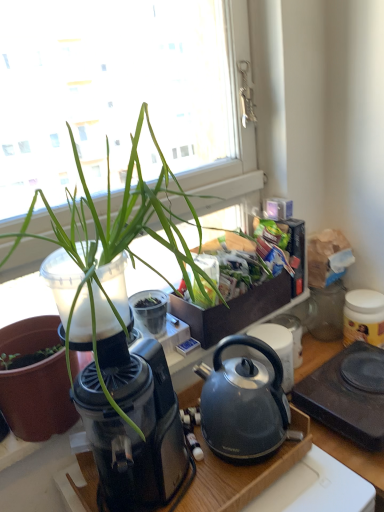
Question: Is matte black kettle at center, the 4th appliance when ordered from right to left, far from black plastic hot plate at lower right, arranged as the second appliance when viewed from the right?

Choices:
 (A) yes
 (B) no

Answer: (B)

Question: From the image's perspective, is matte black kettle at center, the first appliance viewed from the left, on black plastic hot plate at lower right, arranged as the second appliance when viewed from the right?

Choices:
 (A) no
 (B) yes

Answer: (B)

Question: Does matte black kettle at center, the 4th appliance when ordered from right to left, have a lesser height compared to black plastic hot plate at lower right, arranged as the second appliance when viewed from the right?

Choices:
 (A) no
 (B) yes

Answer: (A)

Question: Does matte black kettle at center, the first appliance viewed from the left, turn towards black plastic hot plate at lower right, arranged as the second appliance when viewed from the right?

Choices:
 (A) no
 (B) yes

Answer: (B)

Question: From a real-world perspective, is matte black kettle at center, the first appliance viewed from the left, positioned over black plastic hot plate at lower right, arranged as the second appliance when viewed from the right, based on gravity?

Choices:
 (A) no
 (B) yes

Answer: (B)

Question: From a real-world perspective, is matte black pot at left physically located above or below yellow matte jar at right, which is the 4th appliance from left to right?

Choices:
 (A) below
 (B) above

Answer: (B)

Question: Which is correct: matte black pot at left is inside yellow matte jar at right, which is counted as the first appliance, starting from the right, or outside of it?

Choices:
 (A) outside
 (B) inside

Answer: (A)

Question: Does point (49, 380) appear closer or farther from the camera than point (360, 294)?

Choices:
 (A) farther
 (B) closer

Answer: (B)

Question: Considering the positions of matte black pot at left and yellow matte jar at right, which is counted as the first appliance, starting from the right, in the image, is matte black pot at left wider or thinner than yellow matte jar at right, which is counted as the first appliance, starting from the right,?

Choices:
 (A) thin
 (B) wide

Answer: (B)

Question: From the image's perspective, is transparent plastic coffee machine at left positioned above or below green leafy vegetables at upper right?

Choices:
 (A) above
 (B) below

Answer: (B)

Question: Considering their positions, is transparent plastic coffee machine at left located in front of or behind green leafy vegetables at upper right?

Choices:
 (A) front
 (B) behind

Answer: (A)

Question: Considering the positions of point pos(137,490) and point pos(253,266), is point pos(137,490) closer or farther from the camera than point pos(253,266)?

Choices:
 (A) closer
 (B) farther

Answer: (A)

Question: Is transparent plastic coffee machine at left taller or shorter than green leafy vegetables at upper right?

Choices:
 (A) tall
 (B) short

Answer: (A)

Question: Considering their positions, is black plastic hot plate at lower right, the 3th appliance in the left-to-right sequence, located in front of or behind matte black pot at left?

Choices:
 (A) front
 (B) behind

Answer: (B)

Question: Considering the positions of black plastic hot plate at lower right, arranged as the second appliance when viewed from the right, and matte black pot at left in the image, is black plastic hot plate at lower right, arranged as the second appliance when viewed from the right, bigger or smaller than matte black pot at left?

Choices:
 (A) big
 (B) small

Answer: (B)